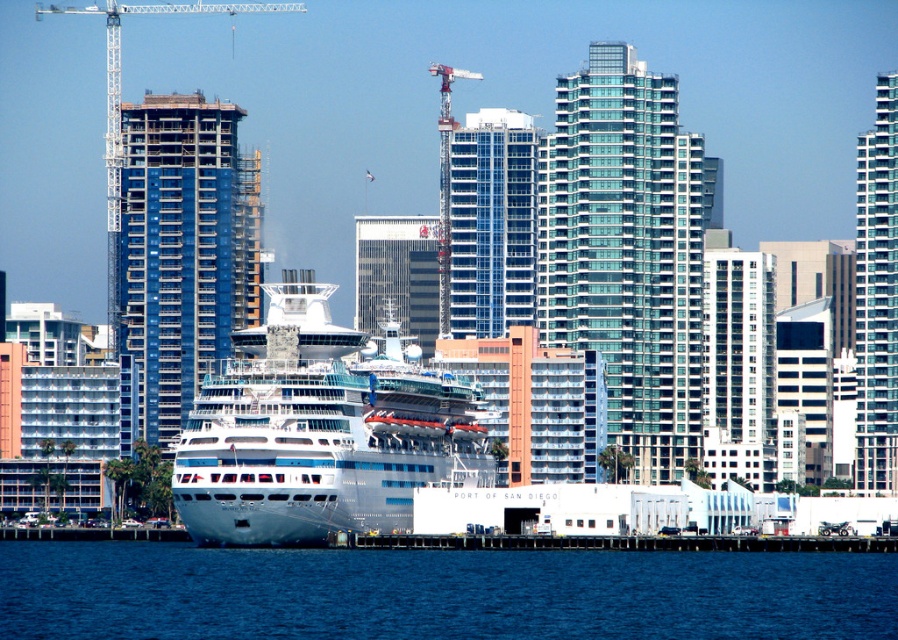
Question: Estimate the real-world distances between objects in this image. Which object is farther from the glassy gray skyscraper at center?

Choices:
 (A) transparent glass skyscraper at right
 (B) blue water at lower center

Answer: (B)

Question: Observing the image, what is the correct spatial positioning of blue water at lower center in reference to white glossy cruise ship at center?

Choices:
 (A) left
 (B) right

Answer: (B)

Question: Does transparent glass building at center have a greater width compared to blue glass building at left?

Choices:
 (A) no
 (B) yes

Answer: (B)

Question: Among these points, which one is nearest to the camera?

Choices:
 (A) (442, 109)
 (B) (571, 544)
 (C) (239, 614)

Answer: (C)

Question: Can you confirm if blue glass building at center is positioned to the right of glassy gray skyscraper at center?

Choices:
 (A) yes
 (B) no

Answer: (A)

Question: Which point is closer to the camera?

Choices:
 (A) (597, 568)
 (B) (443, 208)

Answer: (A)